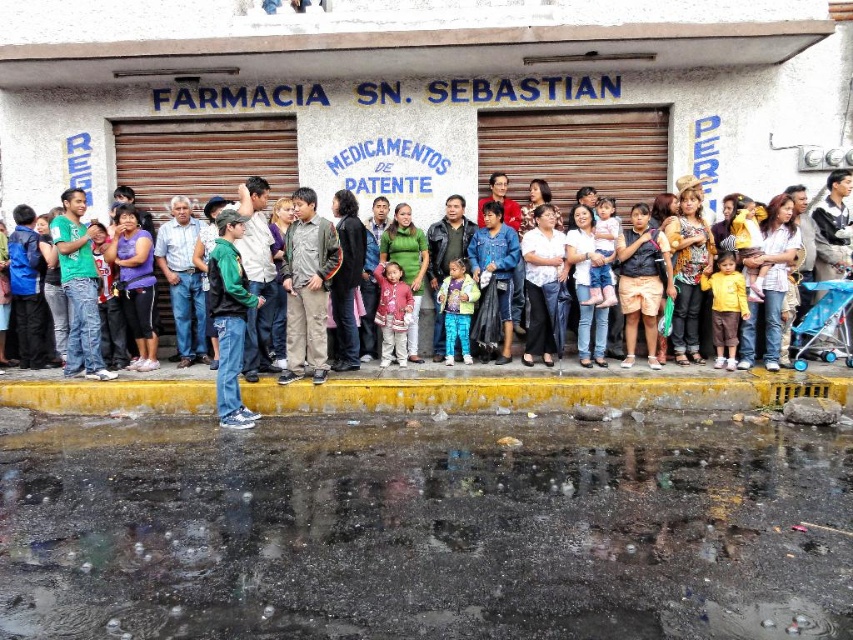
You are a delivery person trying to avoid stepping in the glossy asphalt puddle at lower center while approaching the matte black shirt at center. Which direction should you move to stay clear of the puddle?

The glossy asphalt puddle at lower center is to the left of the matte black shirt at center. To avoid it, move to the right side of the matte black shirt at center.